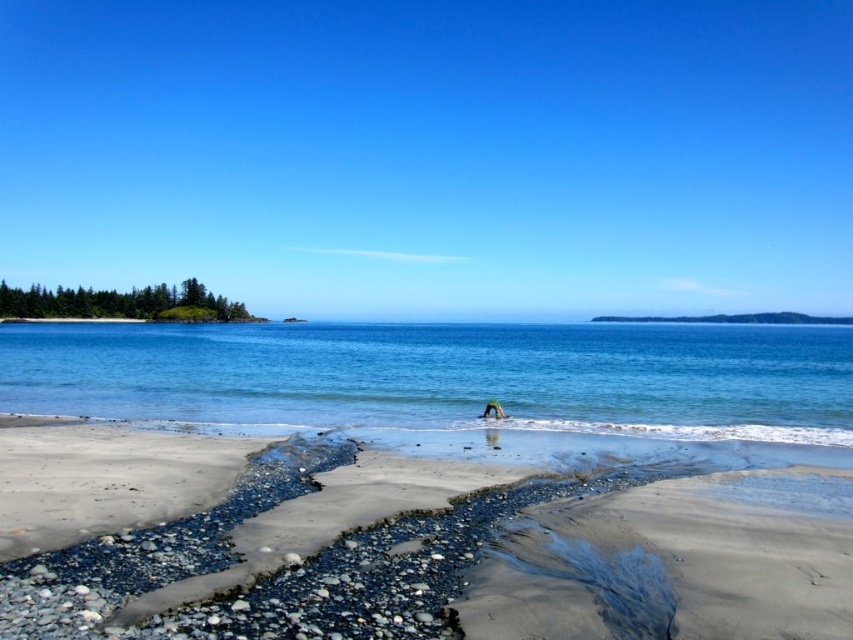
Question: Estimate the real-world distances between objects in this image. Which object is closer to the smooth sand beach at center?

Choices:
 (A) green fabric person at center
 (B) blue water at center

Answer: (A)

Question: Based on their relative distances, which object is farther from the smooth sand beach at center?

Choices:
 (A) blue water at center
 (B) green fabric person at center

Answer: (A)

Question: Which object appears farthest from the camera in this image?

Choices:
 (A) smooth sand beach at center
 (B) green fabric person at center

Answer: (B)

Question: Is smooth sand beach at center to the left of blue water at center from the viewer's perspective?

Choices:
 (A) no
 (B) yes

Answer: (B)

Question: From the image, what is the correct spatial relationship of smooth sand beach at center in relation to green fabric person at center?

Choices:
 (A) left
 (B) right

Answer: (A)

Question: Does smooth sand beach at center appear over green fabric person at center?

Choices:
 (A) yes
 (B) no

Answer: (B)